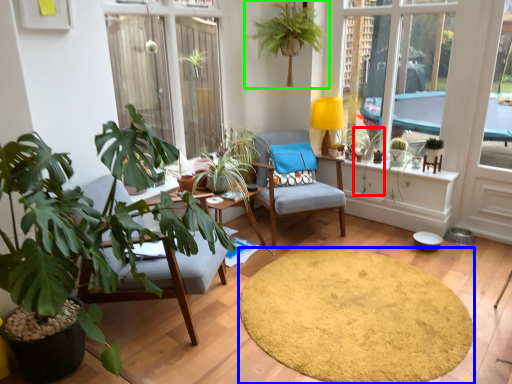
Question: Considering the real-world distances, which object is closest to plant (highlighted by a red box)? mat (highlighted by a blue box) or houseplant (highlighted by a green box).

Choices:
 (A) mat
 (B) houseplant

Answer: (B)